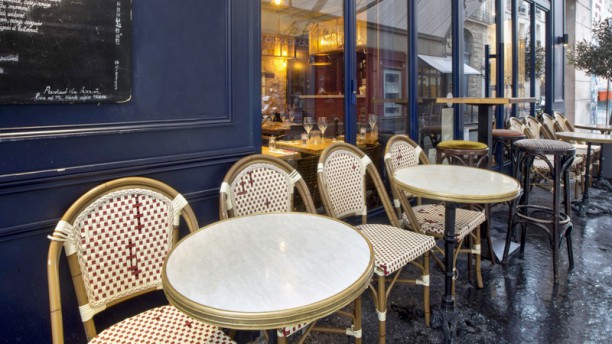
Find the location of a particular element. wooden blue painted beams holding the window panes in on the restuarant building is located at coordinates (351, 80), (412, 77), (459, 70), (501, 76), (515, 69), (532, 71), (549, 72).